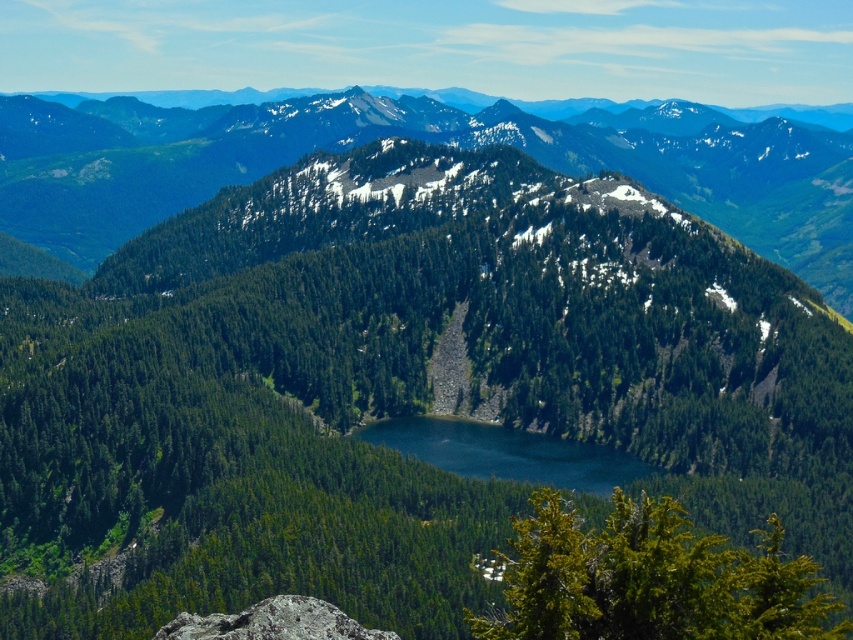
Question: Which point is farther to the camera?

Choices:
 (A) (82, 109)
 (B) (440, 452)

Answer: (A)

Question: Is green forested mountain at center behind deep blue water at center?

Choices:
 (A) no
 (B) yes

Answer: (B)

Question: Among these points, which one is nearest to the camera?

Choices:
 (A) (509, 435)
 (B) (831, 276)

Answer: (A)

Question: Which point appears closest to the camera in this image?

Choices:
 (A) coord(544,435)
 (B) coord(810,176)

Answer: (A)

Question: Can you confirm if green forested mountain at center is positioned to the left of deep blue water at center?

Choices:
 (A) yes
 (B) no

Answer: (B)

Question: Where is green forested mountain at center located in relation to deep blue water at center in the image?

Choices:
 (A) below
 (B) above

Answer: (B)